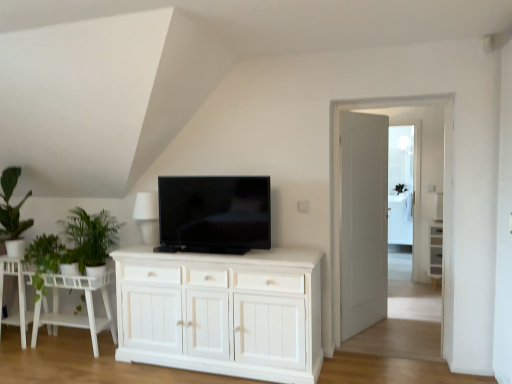
Question: Is transparent glass door at center, the first glass door when ordered from left to right, closer to the viewer compared to black glossy tv at center?

Choices:
 (A) yes
 (B) no

Answer: (B)

Question: From the image's perspective, is transparent glass door at center, the first glass door when ordered from left to right, on top of black glossy tv at center?

Choices:
 (A) no
 (B) yes

Answer: (A)

Question: From the image's perspective, is transparent glass door at center, which appears as the first glass door when viewed from the front, located beneath black glossy tv at center?

Choices:
 (A) no
 (B) yes

Answer: (B)

Question: Can you confirm if transparent glass door at center, the first glass door when ordered from left to right, is positioned to the left of black glossy tv at center?

Choices:
 (A) yes
 (B) no

Answer: (B)

Question: Is transparent glass door at center, which appears as the first glass door when viewed from the front, bigger than black glossy tv at center?

Choices:
 (A) yes
 (B) no

Answer: (A)

Question: From a real-world perspective, relative to white matte lampshade at upper center, is green leafy plant at left, which is the second plant from right to left, vertically above or below?

Choices:
 (A) above
 (B) below

Answer: (B)

Question: Considering the positions of green leafy plant at left, which is the second plant from right to left, and white matte lampshade at upper center in the image, is green leafy plant at left, which is the second plant from right to left, wider or thinner than white matte lampshade at upper center?

Choices:
 (A) wide
 (B) thin

Answer: (A)

Question: From their relative heights in the image, would you say green leafy plant at left, which is the second plant from right to left, is taller or shorter than white matte lampshade at upper center?

Choices:
 (A) tall
 (B) short

Answer: (B)

Question: In the image, is green leafy plant at left, the first plant in the left-to-right sequence, positioned in front of or behind white matte lampshade at upper center?

Choices:
 (A) behind
 (B) front

Answer: (A)

Question: Is white wood side table at lower left, acting as the 2th table starting from the right, in front of or behind white wood table at lower left, marked as the second table in a left-to-right arrangement, in the image?

Choices:
 (A) behind
 (B) front

Answer: (A)

Question: Is white wood side table at lower left, the first table from the left, bigger or smaller than white wood table at lower left, which is the 1th table in right-to-left order?

Choices:
 (A) small
 (B) big

Answer: (A)

Question: In terms of height, does white wood side table at lower left, the first table from the left, look taller or shorter compared to white wood table at lower left, which is the 1th table in right-to-left order?

Choices:
 (A) short
 (B) tall

Answer: (B)

Question: From a real-world perspective, is white wood side table at lower left, the first table from the left, physically located above or below white wood table at lower left, marked as the second table in a left-to-right arrangement?

Choices:
 (A) below
 (B) above

Answer: (B)

Question: In terms of size, does white wood side table at lower left, acting as the 2th table starting from the right, appear bigger or smaller than white wood cabinet at right?

Choices:
 (A) small
 (B) big

Answer: (B)

Question: In terms of width, does white wood side table at lower left, the first table from the left, look wider or thinner when compared to white wood cabinet at right?

Choices:
 (A) wide
 (B) thin

Answer: (A)